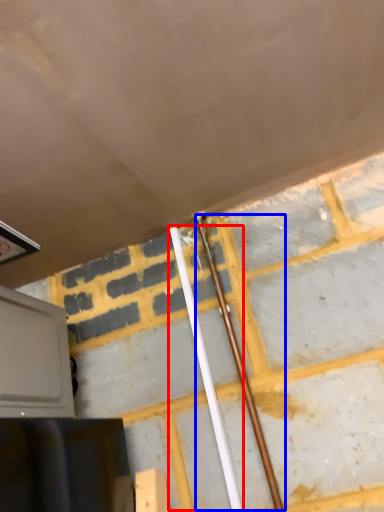
Question: Which of the following is the closest to the observer, beam (highlighted by a red box) or beam (highlighted by a blue box)?

Choices:
 (A) beam
 (B) beam

Answer: (B)